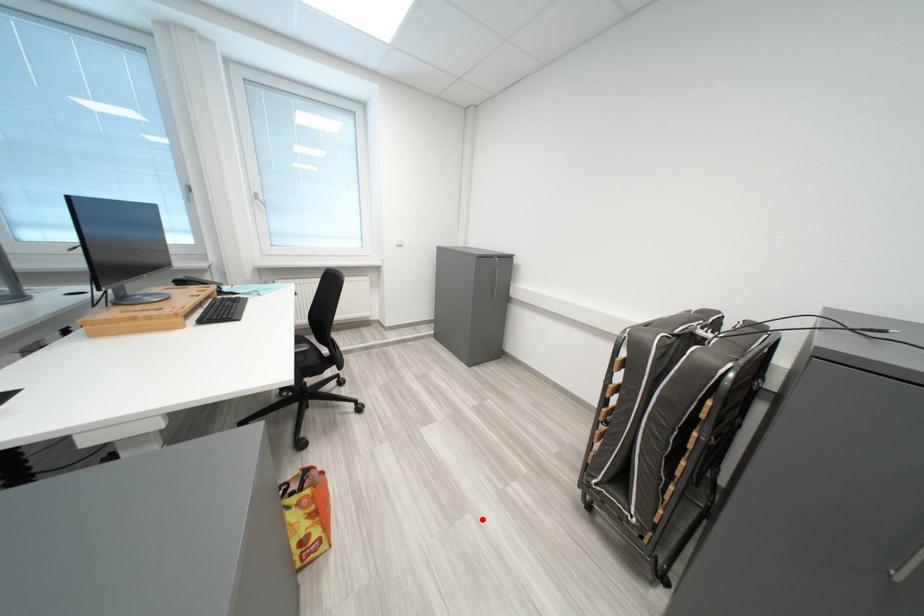
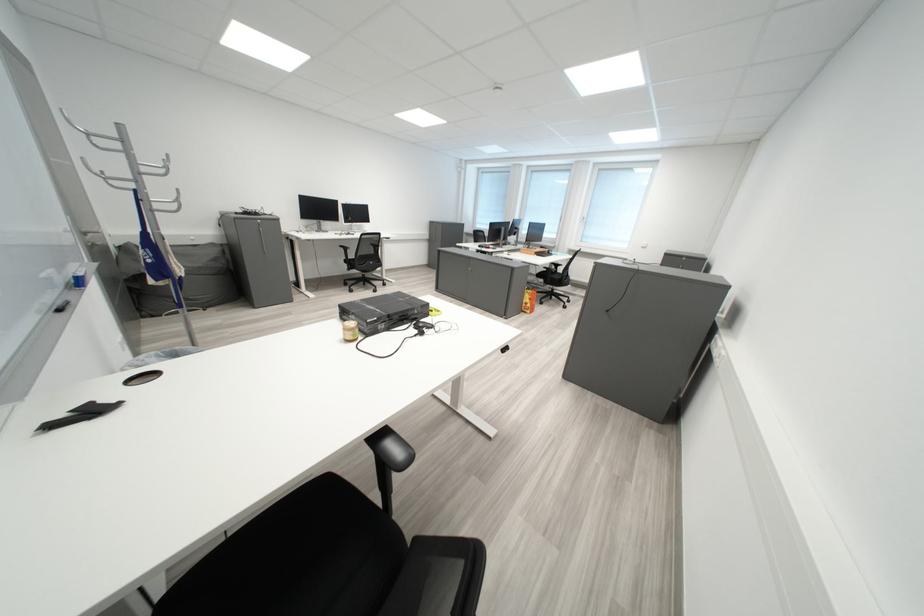
The point at the highlighted location is marked in the first image. Where is the corresponding point in the second image?

(574, 333)